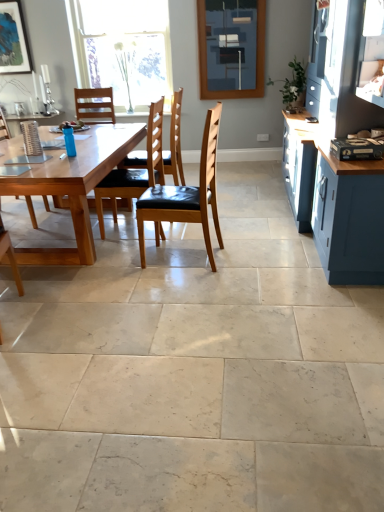
Question: Does wooden chair at center, marked as the third chair in a right-to-left arrangement, have a larger size compared to matte blue cabinet at right?

Choices:
 (A) no
 (B) yes

Answer: (A)

Question: From the image's perspective, is wooden chair at center, acting as the second chair starting from the left, above matte blue cabinet at right?

Choices:
 (A) yes
 (B) no

Answer: (B)

Question: Is wooden chair at center, marked as the third chair in a right-to-left arrangement, oriented away from matte blue cabinet at right?

Choices:
 (A) no
 (B) yes

Answer: (B)

Question: From a real-world perspective, is wooden chair at center, marked as the third chair in a right-to-left arrangement, under matte blue cabinet at right?

Choices:
 (A) no
 (B) yes

Answer: (B)

Question: Is wooden chair at center, acting as the second chair starting from the left, taller than matte blue cabinet at right?

Choices:
 (A) yes
 (B) no

Answer: (B)

Question: Is wooden chair at center, marked as the third chair in a right-to-left arrangement, in front of matte blue cabinet at right?

Choices:
 (A) no
 (B) yes

Answer: (A)

Question: From a real-world perspective, does wooden chair at left, which ranks as the 1th chair in left-to-right order, sit lower than wooden chair with black cushion at center, which is the 3th chair from left to right?

Choices:
 (A) yes
 (B) no

Answer: (A)

Question: Is wooden chair at left, arranged as the fourth chair when viewed from the right, positioned with its back to wooden chair with black cushion at center, which is the 3th chair from left to right?

Choices:
 (A) yes
 (B) no

Answer: (B)

Question: Is wooden chair at left, arranged as the fourth chair when viewed from the right, surrounding wooden chair with black cushion at center, which is the 3th chair from left to right?

Choices:
 (A) yes
 (B) no

Answer: (B)

Question: From the image's perspective, is wooden chair at left, arranged as the fourth chair when viewed from the right, on top of wooden chair with black cushion at center, the 2th chair viewed from the right?

Choices:
 (A) yes
 (B) no

Answer: (B)

Question: Is wooden chair at left, arranged as the fourth chair when viewed from the right, touching wooden chair with black cushion at center, which is the 3th chair from left to right?

Choices:
 (A) yes
 (B) no

Answer: (B)

Question: Is wooden chair at left, arranged as the fourth chair when viewed from the right, thinner than wooden chair with black cushion at center, the 2th chair viewed from the right?

Choices:
 (A) yes
 (B) no

Answer: (A)

Question: Considering the relative sizes of matte blue cabinet at right and clear glass window at upper center in the image provided, is matte blue cabinet at right shorter than clear glass window at upper center?

Choices:
 (A) yes
 (B) no

Answer: (B)